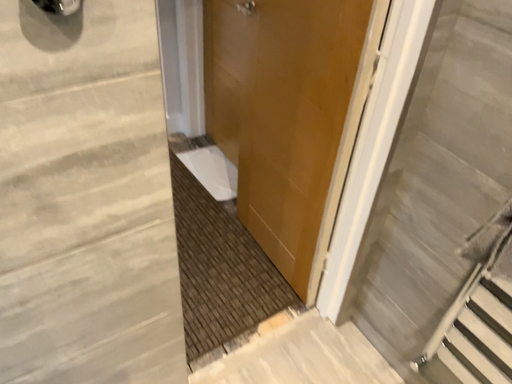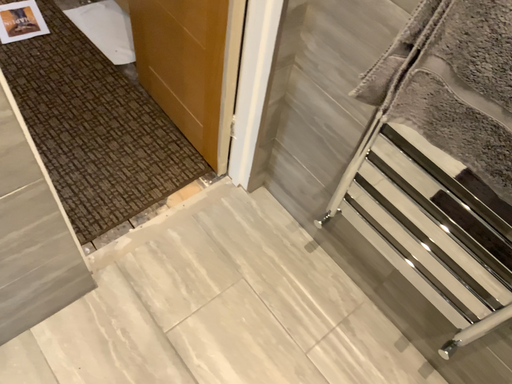
Question: How did the camera likely rotate when shooting the video?

Choices:
 (A) rotated right
 (B) rotated left

Answer: (A)